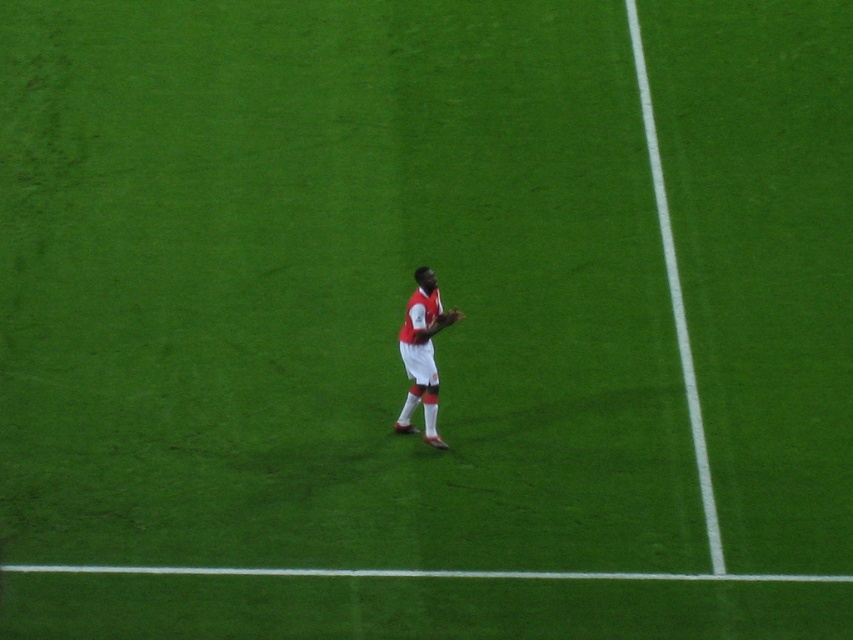
You are a soccer coach observing a practice session on the field. You notice a white matte soccer player at center and a brown leather glove at center. Which object is positioned lower in the image?

The white matte soccer player at center is below brown leather glove at center, so the soccer player is positioned lower in the image.

You are a soccer coach observing the field. You see the white matte soccer player at center and the brown leather glove at center. Which object is closer to you?

The white matte soccer player at center is closer to you because it is in front of the brown leather glove at center.